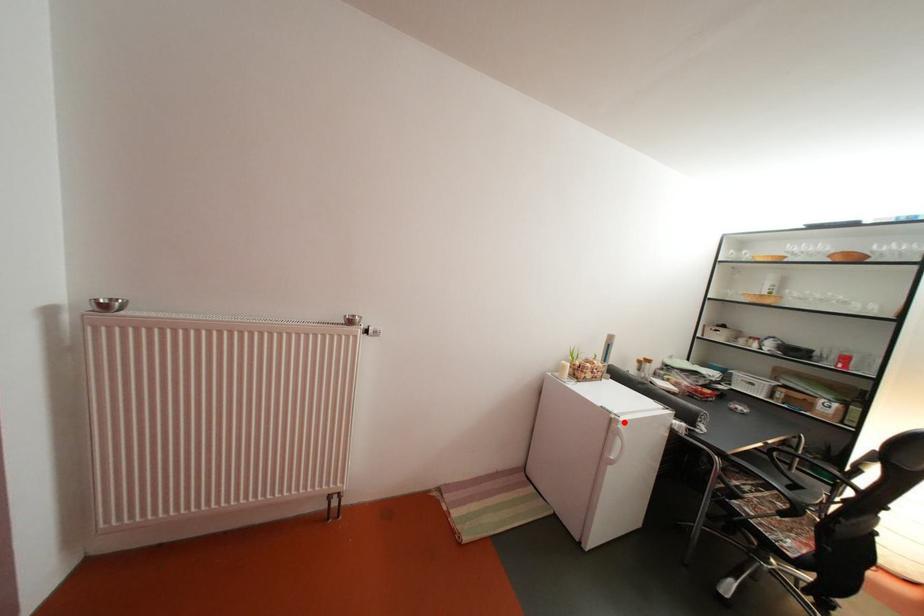
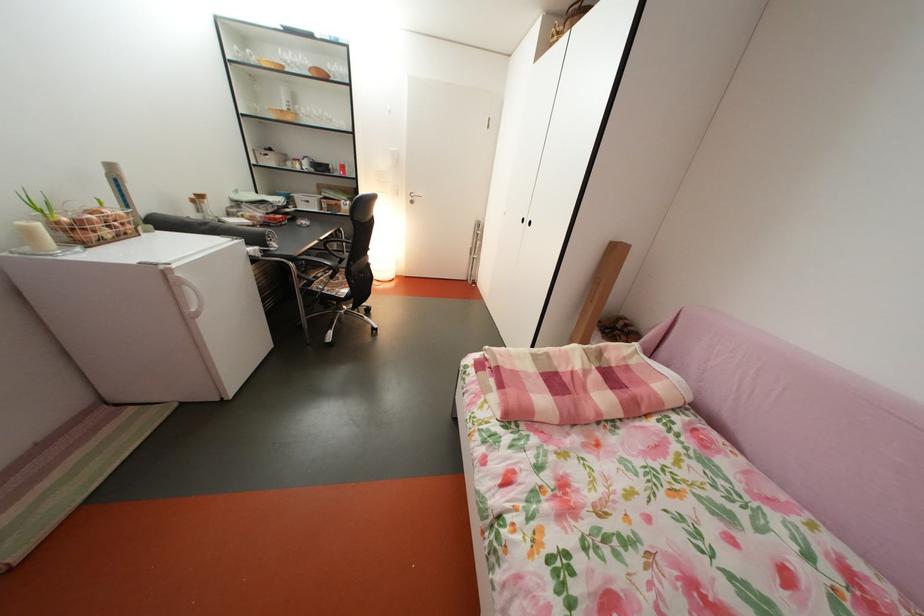
The point at the highlighted location is marked in the first image. Where is the corresponding point in the second image?

(174, 274)